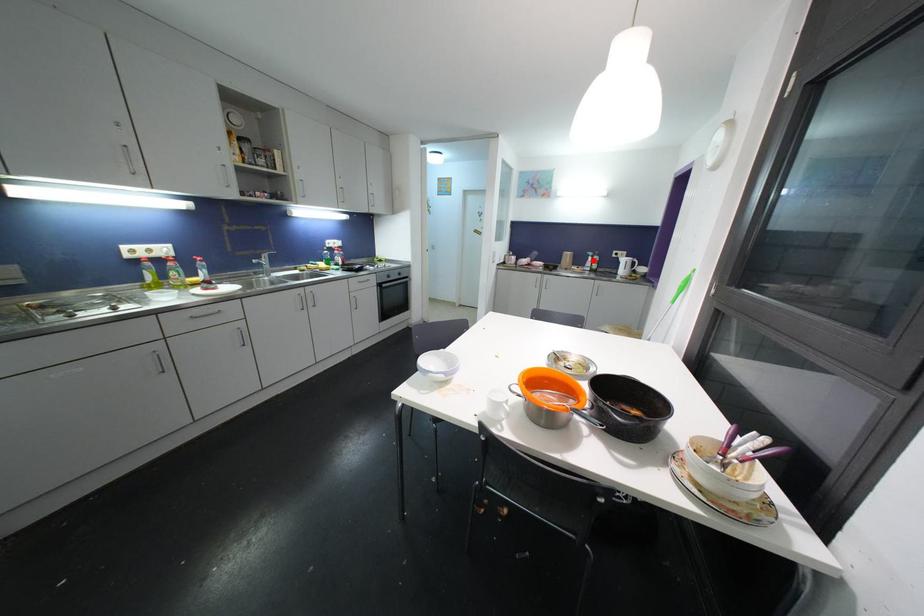
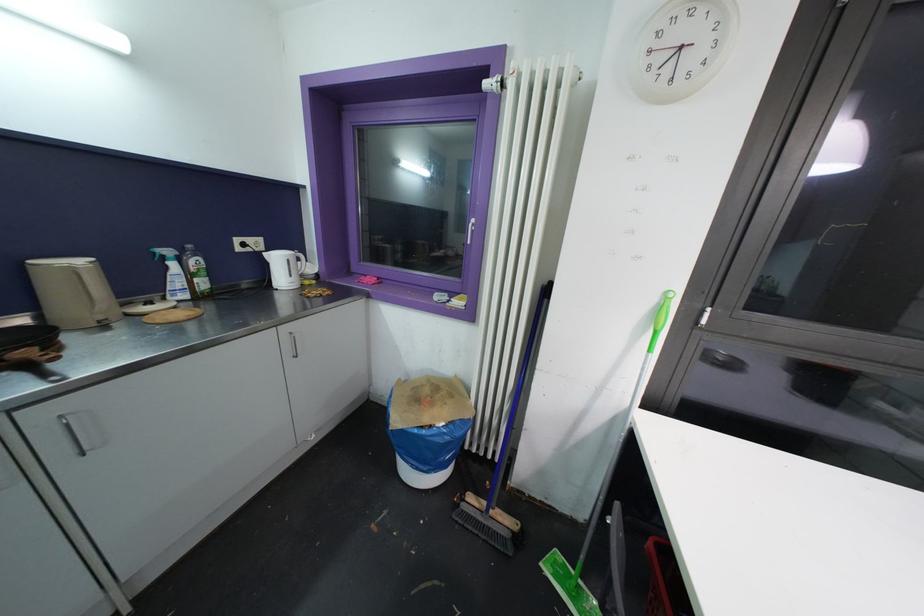
Where in the second image is the point corresponding to the highlighted location from the first image?

(176, 267)